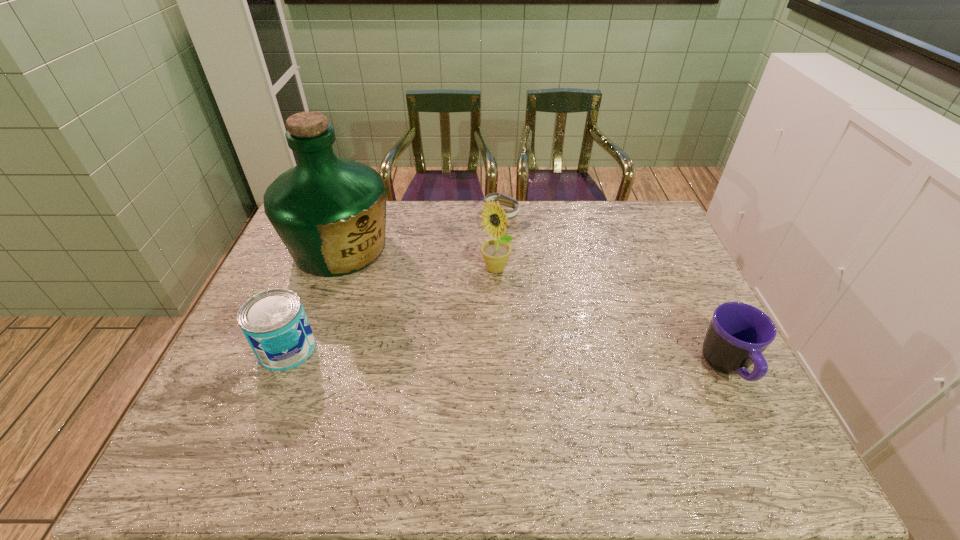
Image resolution: width=960 pixels, height=540 pixels. In order to click on liquor located at the left edge in this screenshot , I will do `click(330, 213)`.

Locate an element on the screen. object located at the right edge is located at coordinates (738, 334).

Image resolution: width=960 pixels, height=540 pixels. I want to click on object that is at the far left corner, so click(x=330, y=213).

Find the location of a particular element. The width and height of the screenshot is (960, 540). object at the near right corner is located at coordinates (738, 334).

Image resolution: width=960 pixels, height=540 pixels. In the image, there is a desktop. Identify the location of vacant space at the far edge. (474, 221).

The image size is (960, 540). In the image, there is a desktop. Find the location of `blank space at the near edge`. blank space at the near edge is located at coordinates (420, 415).

Locate an element on the screen. This screenshot has height=540, width=960. free space at the left edge of the desktop is located at coordinates (221, 368).

Identify the location of free space at the right edge of the desktop. This screenshot has height=540, width=960. (647, 275).

Where is `vacant region at the near left corner of the desktop`? The image size is (960, 540). vacant region at the near left corner of the desktop is located at coordinates (240, 424).

Image resolution: width=960 pixels, height=540 pixels. What are the coordinates of `vacant space at the far right corner of the desktop` in the screenshot? It's located at (628, 215).